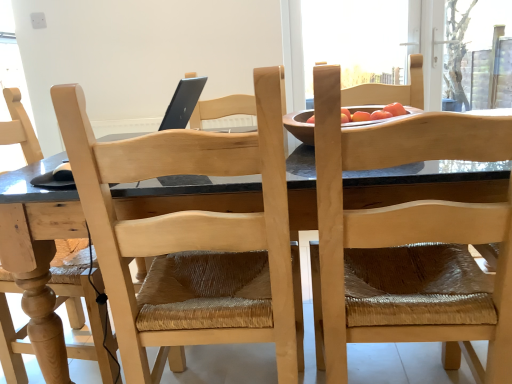
Question: Should I look upward or downward to see transparent plastic screen at upper right, which is the first window screen in right-to-left order?

Choices:
 (A) down
 (B) up

Answer: (B)

Question: From a real-world perspective, is transparent glass window screen at upper center, positioned as the 2th window screen in right-to-left order, positioned under transparent plastic screen at upper right, which is counted as the 2th window screen, starting from the left, based on gravity?

Choices:
 (A) no
 (B) yes

Answer: (A)

Question: Is transparent glass window screen at upper center, positioned as the 2th window screen in right-to-left order, outside of transparent plastic screen at upper right, which is counted as the 2th window screen, starting from the left?

Choices:
 (A) yes
 (B) no

Answer: (A)

Question: Would you say transparent glass window screen at upper center, the 1th window screen in the left-to-right sequence, is a long distance from transparent plastic screen at upper right, which is the first window screen in right-to-left order?

Choices:
 (A) no
 (B) yes

Answer: (B)

Question: From the image's perspective, is transparent glass window screen at upper center, the 1th window screen in the left-to-right sequence, located above transparent plastic screen at upper right, which is the first window screen in right-to-left order?

Choices:
 (A) no
 (B) yes

Answer: (B)

Question: Is transparent glass window screen at upper center, the 1th window screen in the left-to-right sequence, in contact with transparent plastic screen at upper right, which is the first window screen in right-to-left order?

Choices:
 (A) yes
 (B) no

Answer: (B)

Question: Is transparent glass window screen at upper center, positioned as the 2th window screen in right-to-left order, shorter than transparent plastic screen at upper right, which is the first window screen in right-to-left order?

Choices:
 (A) no
 (B) yes

Answer: (B)

Question: From the image's perspective, is natural wood chair at upper right, which is counted as the second chair, starting from the left, under transparent plastic screen at upper right, which is counted as the 2th window screen, starting from the left?

Choices:
 (A) yes
 (B) no

Answer: (A)

Question: Does natural wood chair at upper right, which is counted as the second chair, starting from the left, have a larger size compared to transparent plastic screen at upper right, which is counted as the 2th window screen, starting from the left?

Choices:
 (A) yes
 (B) no

Answer: (A)

Question: Considering the relative positions of natural wood chair at upper right, which is counted as the second chair, starting from the left, and transparent plastic screen at upper right, which is counted as the 2th window screen, starting from the left, in the image provided, is natural wood chair at upper right, which is counted as the second chair, starting from the left, to the right of transparent plastic screen at upper right, which is counted as the 2th window screen, starting from the left, from the viewer's perspective?

Choices:
 (A) yes
 (B) no

Answer: (B)

Question: Can you confirm if natural wood chair at upper right, marked as the first chair in a right-to-left arrangement, is taller than transparent plastic screen at upper right, which is the first window screen in right-to-left order?

Choices:
 (A) no
 (B) yes

Answer: (B)

Question: Is natural wood chair at upper right, which is counted as the second chair, starting from the left, shorter than transparent plastic screen at upper right, which is the first window screen in right-to-left order?

Choices:
 (A) no
 (B) yes

Answer: (A)

Question: From a real-world perspective, does natural wood chair at upper right, marked as the first chair in a right-to-left arrangement, sit lower than transparent plastic screen at upper right, which is counted as the 2th window screen, starting from the left?

Choices:
 (A) yes
 (B) no

Answer: (A)

Question: Is natural wood chair at upper right, marked as the first chair in a right-to-left arrangement, in front of transparent glass window screen at upper center, positioned as the 2th window screen in right-to-left order?

Choices:
 (A) yes
 (B) no

Answer: (A)